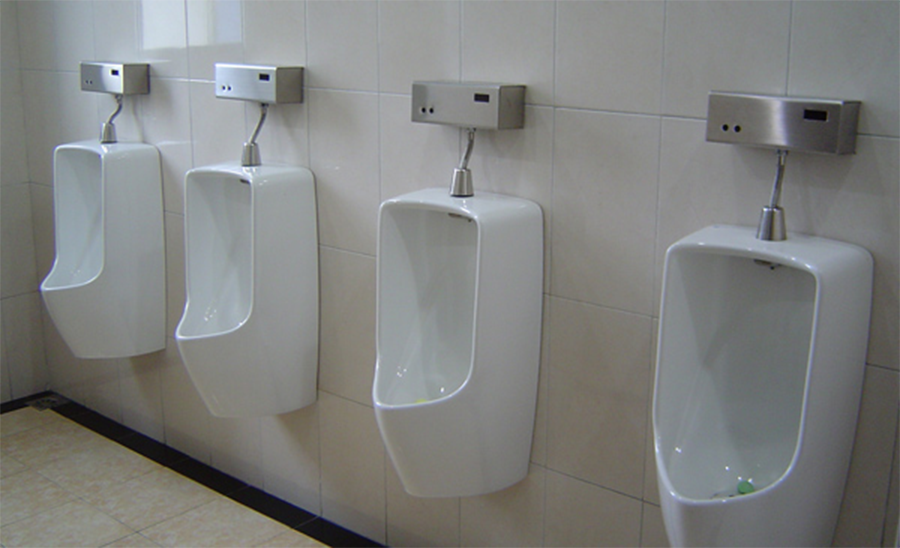
The width and height of the screenshot is (900, 548). Find the location of `floor tiles`. floor tiles is located at coordinates (49, 437), (20, 415), (96, 468), (141, 499), (226, 534), (293, 535), (13, 462), (37, 487), (78, 528), (140, 540).